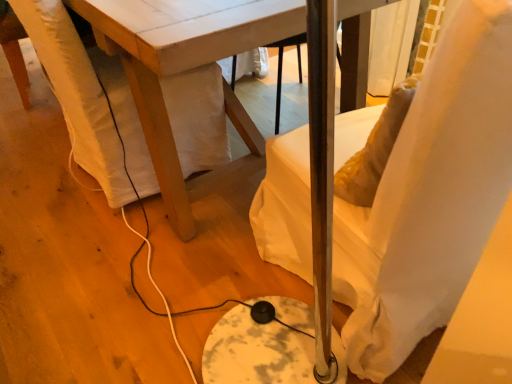
Question: Is white fabric swivel chair at lower left not within white wood table at center?

Choices:
 (A) yes
 (B) no

Answer: (B)

Question: Can you confirm if white fabric swivel chair at lower left is taller than white wood table at center?

Choices:
 (A) yes
 (B) no

Answer: (B)

Question: Can you confirm if white fabric swivel chair at lower left is wider than white wood table at center?

Choices:
 (A) no
 (B) yes

Answer: (A)

Question: Is white fabric swivel chair at lower left closer to the viewer compared to white wood table at center?

Choices:
 (A) yes
 (B) no

Answer: (B)

Question: From the image's perspective, is white fabric swivel chair at lower left below white wood table at center?

Choices:
 (A) yes
 (B) no

Answer: (A)

Question: Is white fabric swivel chair at lower left smaller than white wood table at center?

Choices:
 (A) yes
 (B) no

Answer: (A)

Question: From the image's perspective, is white fabric chair at right over white wood table at center?

Choices:
 (A) yes
 (B) no

Answer: (B)

Question: Is white fabric chair at right further to the viewer compared to white wood table at center?

Choices:
 (A) no
 (B) yes

Answer: (A)

Question: Is white fabric chair at right aimed at white wood table at center?

Choices:
 (A) no
 (B) yes

Answer: (B)

Question: Is white fabric chair at right positioned beyond the bounds of white wood table at center?

Choices:
 (A) no
 (B) yes

Answer: (B)

Question: Considering the relative sizes of white fabric chair at right and white wood table at center in the image provided, is white fabric chair at right thinner than white wood table at center?

Choices:
 (A) no
 (B) yes

Answer: (B)

Question: Can you confirm if white fabric chair at right is positioned to the left of white wood table at center?

Choices:
 (A) no
 (B) yes

Answer: (A)

Question: Considering the relative sizes of white fabric swivel chair at lower left and white fabric chair at right in the image provided, is white fabric swivel chair at lower left smaller than white fabric chair at right?

Choices:
 (A) no
 (B) yes

Answer: (B)